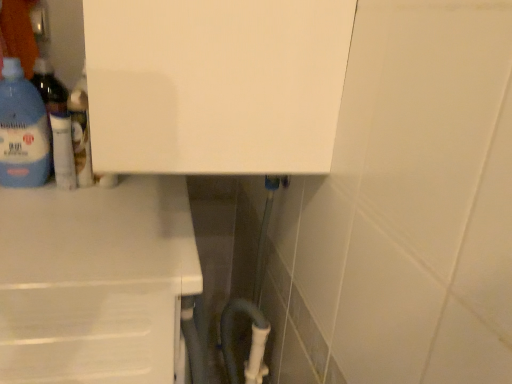
Locate an element on the screen. This screenshot has width=512, height=384. vacant area that is situated to the right of translucent plastic bottle at left, which appears as the 1th bottle when viewed from the left is located at coordinates [90, 192].